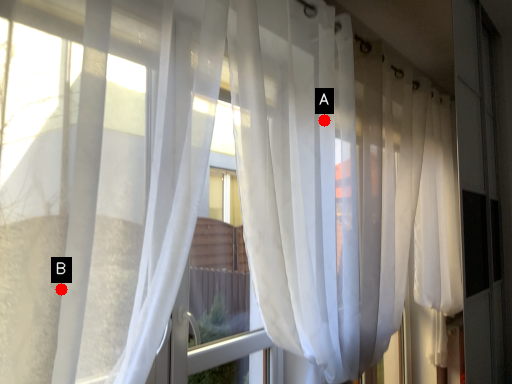
Question: Two points are circled on the image, labeled by A and B beside each circle. Which point is further to the camera?

Choices:
 (A) A is further
 (B) B is further

Answer: (A)